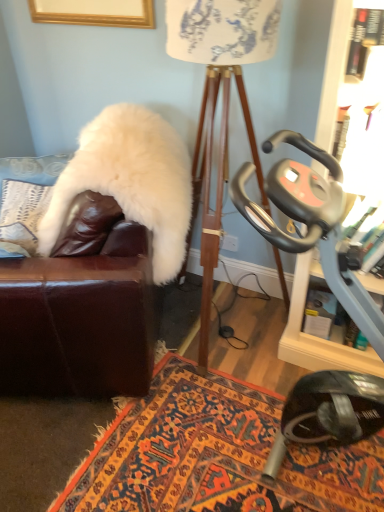
Question: Is white fluffy fur coat at left a part of carpeted rug at center?

Choices:
 (A) no
 (B) yes

Answer: (A)

Question: Considering the relative sizes of carpeted rug at center and white fluffy fur coat at left in the image provided, is carpeted rug at center thinner than white fluffy fur coat at left?

Choices:
 (A) yes
 (B) no

Answer: (B)

Question: Can you confirm if carpeted rug at center is positioned to the left of white fluffy fur coat at left?

Choices:
 (A) no
 (B) yes

Answer: (A)

Question: Is carpeted rug at center shorter than white fluffy fur coat at left?

Choices:
 (A) no
 (B) yes

Answer: (B)

Question: Considering the relative sizes of carpeted rug at center and white fluffy fur coat at left in the image provided, is carpeted rug at center taller than white fluffy fur coat at left?

Choices:
 (A) no
 (B) yes

Answer: (A)

Question: Considering the positions of metallic gray stationary bike at right and carpeted rug at center in the image, is metallic gray stationary bike at right taller or shorter than carpeted rug at center?

Choices:
 (A) tall
 (B) short

Answer: (A)

Question: From a real-world perspective, is metallic gray stationary bike at right positioned above or below carpeted rug at center?

Choices:
 (A) above
 (B) below

Answer: (A)

Question: In terms of width, does metallic gray stationary bike at right look wider or thinner when compared to carpeted rug at center?

Choices:
 (A) wide
 (B) thin

Answer: (B)

Question: Is metallic gray stationary bike at right in front of or behind carpeted rug at center in the image?

Choices:
 (A) behind
 (B) front

Answer: (B)

Question: Is white fluffy fur coat at left inside or outside of carpeted rug at center?

Choices:
 (A) inside
 (B) outside

Answer: (B)

Question: Is white fluffy fur coat at left taller or shorter than carpeted rug at center?

Choices:
 (A) tall
 (B) short

Answer: (A)

Question: Based on their sizes in the image, would you say white fluffy fur coat at left is bigger or smaller than carpeted rug at center?

Choices:
 (A) big
 (B) small

Answer: (A)

Question: From a real-world perspective, is white fluffy fur coat at left physically located above or below carpeted rug at center?

Choices:
 (A) below
 (B) above

Answer: (B)

Question: Is white fluffy pillow at upper left situated inside white fabric lampshade at center or outside?

Choices:
 (A) inside
 (B) outside

Answer: (B)

Question: From the image's perspective, is white fluffy pillow at upper left located above or below white fabric lampshade at center?

Choices:
 (A) above
 (B) below

Answer: (B)